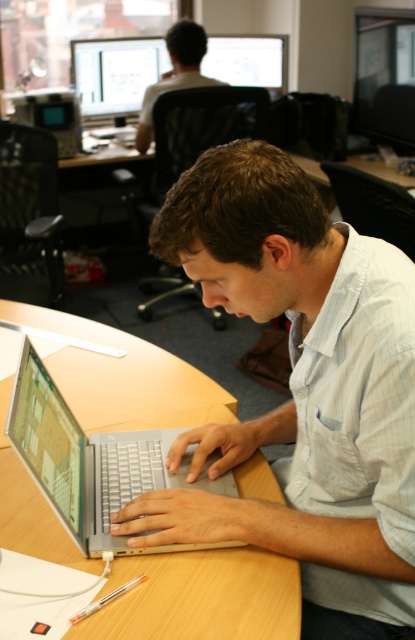
Question: Considering the relative positions of matte silver laptop at center and matte black monitor at upper right in the image provided, where is matte silver laptop at center located with respect to matte black monitor at upper right?

Choices:
 (A) right
 (B) left

Answer: (B)

Question: Among these points, which one is nearest to the camera?

Choices:
 (A) click(x=249, y=518)
 (B) click(x=412, y=140)

Answer: (A)

Question: Which point is closer to the camera?

Choices:
 (A) (200, 28)
 (B) (141, 54)
 (C) (332, 476)

Answer: (C)

Question: Which of the following is the farthest from the observer?

Choices:
 (A) matte black monitor at upper right
 (B) matte black monitor at upper left
 (C) matte silver laptop at center
 (D) silver metallic laptop at center

Answer: (B)

Question: Observing the image, what is the correct spatial positioning of matte black monitor at upper left in reference to matte white shirt at upper center?

Choices:
 (A) below
 (B) above

Answer: (B)

Question: From the image, what is the correct spatial relationship of matte black monitor at upper right in relation to matte black monitor at upper left?

Choices:
 (A) left
 (B) right

Answer: (B)